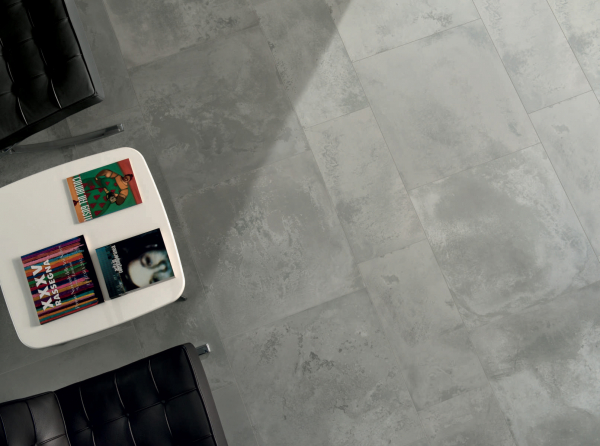
This screenshot has height=446, width=600. Identify the location of table. (23, 226).